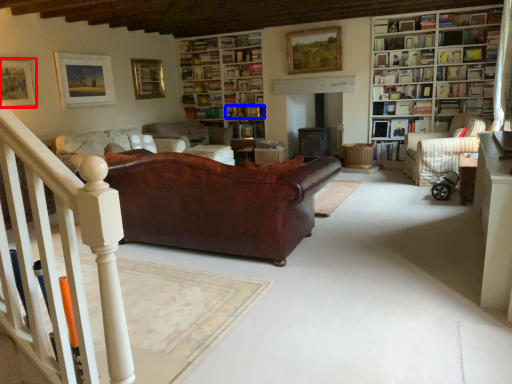
Question: Among these objects, which one is nearest to the camera, picture frame (highlighted by a red box) or book (highlighted by a blue box)?

Choices:
 (A) picture frame
 (B) book

Answer: (A)